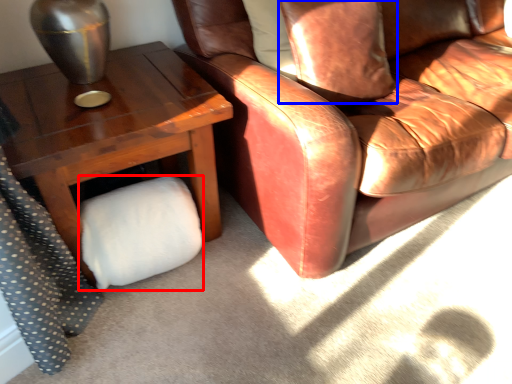
Question: Which point is further to the camera, toilet paper (highlighted by a red box) or pillow (highlighted by a blue box)?

Choices:
 (A) toilet paper
 (B) pillow

Answer: (B)